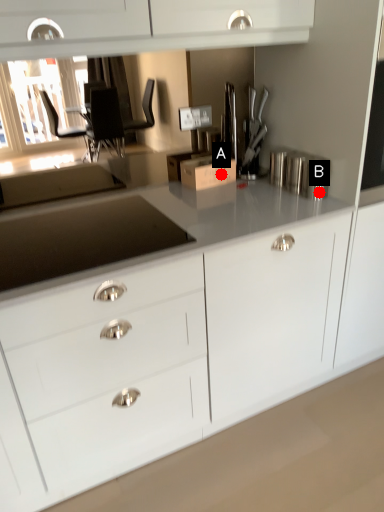
Question: Two points are circled on the image, labeled by A and B beside each circle. Which point is farther to the camera?

Choices:
 (A) A is further
 (B) B is further

Answer: (A)